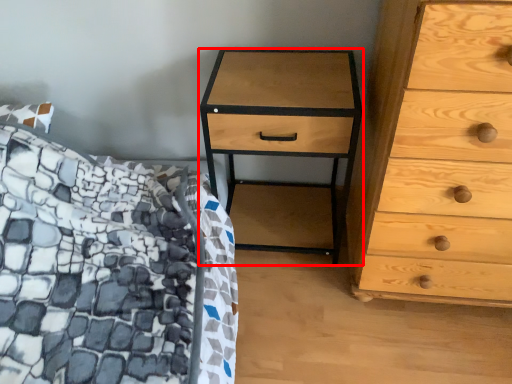
Question: Observing the image, what is the correct spatial positioning of nightstand (annotated by the red box) in reference to chest of drawers?

Choices:
 (A) left
 (B) right

Answer: (A)